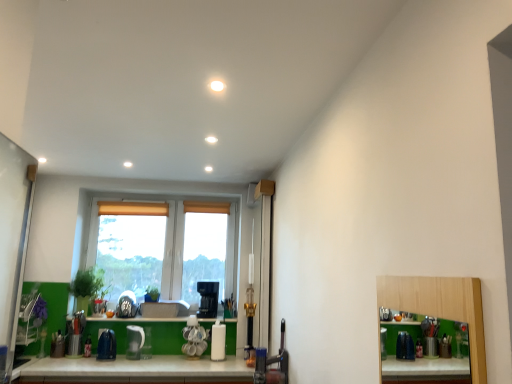
This screenshot has height=384, width=512. Describe the element at coordinates (152, 294) in the screenshot. I see `green matte plant at center, arranged as the first plant when viewed from the right` at that location.

This screenshot has height=384, width=512. What are the coordinates of `white glossy kettle at center, placed as the 2th appliance when sorted from left to right` in the screenshot? It's located at (134, 342).

Locate an element on the screen. white plastic window at center is located at coordinates (165, 251).

The height and width of the screenshot is (384, 512). I want to click on blue plastic kettle at lower center, the third appliance positioned from the right, so click(106, 345).

Is blue plastic kettle at lower center, placed as the 1th appliance when sorted from left to right, not close to white glossy kettle at center, placed as the second appliance when sorted from right to left?

Actually, blue plastic kettle at lower center, placed as the 1th appliance when sorted from left to right, and white glossy kettle at center, placed as the second appliance when sorted from right to left, are a little close together.

From the picture: From the image's perspective, which is above, blue plastic kettle at lower center, placed as the 1th appliance when sorted from left to right, or white glossy kettle at center, placed as the second appliance when sorted from right to left?

From the image's view, white glossy kettle at center, placed as the second appliance when sorted from right to left, is above.

From a real-world perspective, is blue plastic kettle at lower center, the third appliance positioned from the right, physically located above or below white glossy kettle at center, placed as the 2th appliance when sorted from left to right?

From a real-world perspective, blue plastic kettle at lower center, the third appliance positioned from the right, is physically below white glossy kettle at center, placed as the 2th appliance when sorted from left to right.

Is blue plastic kettle at lower center, placed as the 1th appliance when sorted from left to right, in front of or behind white glossy kettle at center, placed as the second appliance when sorted from right to left, in the image?

In the image, blue plastic kettle at lower center, placed as the 1th appliance when sorted from left to right, appears in front of white glossy kettle at center, placed as the second appliance when sorted from right to left.

How many degrees apart are the facing directions of blue plastic kettle at lower center, the third appliance positioned from the right, and green matte plant at center, arranged as the first plant when viewed from the right?

2.88 degrees separate the facing orientations of blue plastic kettle at lower center, the third appliance positioned from the right, and green matte plant at center, arranged as the first plant when viewed from the right.

Looking at their sizes, would you say blue plastic kettle at lower center, placed as the 1th appliance when sorted from left to right, is wider or thinner than green matte plant at center, which is the second plant in left-to-right order?

In the image, blue plastic kettle at lower center, placed as the 1th appliance when sorted from left to right, appears to be wider than green matte plant at center, which is the second plant in left-to-right order.

Which is closer to the camera, (109, 354) or (156, 292)?

Point (109, 354) appears to be closer to the viewer than point (156, 292).

Which of these two, blue plastic kettle at lower center, placed as the 1th appliance when sorted from left to right, or green matte plant at center, which is the second plant in left-to-right order, stands taller?

Standing taller between the two is blue plastic kettle at lower center, placed as the 1th appliance when sorted from left to right.

From a real-world perspective, between white glossy kettle at center, placed as the 2th appliance when sorted from left to right, and green matte plant at left, the 2th plant positioned from the right, who is vertically lower?

In real-world perspective, white glossy kettle at center, placed as the 2th appliance when sorted from left to right, is lower.

Is white glossy kettle at center, placed as the 2th appliance when sorted from left to right, looking in the opposite direction of green matte plant at left, acting as the 1th plant starting from the left?

white glossy kettle at center, placed as the 2th appliance when sorted from left to right, does not have its back to green matte plant at left, acting as the 1th plant starting from the left.

From the image's perspective, would you say white glossy kettle at center, placed as the 2th appliance when sorted from left to right, is shown under green matte plant at left, the 2th plant positioned from the right?

Yes, from the image's perspective, white glossy kettle at center, placed as the 2th appliance when sorted from left to right, is below green matte plant at left, the 2th plant positioned from the right.

Is point (182, 350) positioned in front of point (208, 281)?

Yes, point (182, 350) is closer to viewer.

Is white glossy coffee maker at center, placed as the 3th appliance when sorted from left to right, inside or outside of black plastic coffee machine at center?

white glossy coffee maker at center, placed as the 3th appliance when sorted from left to right, is located beyond the bounds of black plastic coffee machine at center.

Does white glossy coffee maker at center, which appears as the first appliance when viewed from the right, have a greater height compared to black plastic coffee machine at center?

Correct, white glossy coffee maker at center, which appears as the first appliance when viewed from the right, is much taller as black plastic coffee machine at center.

From the white plastic window at center, count the 2nd plant to the left and point to it. Please provide its 2D coordinates.

[(88, 287)]

Which of these two, green matte plant at left, the 2th plant positioned from the right, or white plastic window at center, stands taller?

Standing taller between the two is white plastic window at center.

Does green matte plant at left, the 2th plant positioned from the right, contain white plastic window at center?

Actually, white plastic window at center is outside green matte plant at left, the 2th plant positioned from the right.

Is green matte plant at left, the 2th plant positioned from the right, turned away from white plastic window at center?

Yes, green matte plant at left, the 2th plant positioned from the right, is facing away from white plastic window at center.

Find the location of `the 3rd appliance to the right of the green matte plant at left, the 2th plant positioned from the right, starting your count from the anchor`. the 3rd appliance to the right of the green matte plant at left, the 2th plant positioned from the right, starting your count from the anchor is located at coordinates (194, 338).

Is there a large distance between green matte plant at left, the 2th plant positioned from the right, and white glossy coffee maker at center, which appears as the first appliance when viewed from the right?

No, green matte plant at left, the 2th plant positioned from the right, is not far from white glossy coffee maker at center, which appears as the first appliance when viewed from the right.

Between point (76, 280) and point (188, 321), which one is positioned behind?

The point (76, 280) is farther from the camera.

How many degrees apart are the facing directions of green matte plant at center, which is the second plant in left-to-right order, and green matte window sill at lower center?

2.51 degrees separate the facing orientations of green matte plant at center, which is the second plant in left-to-right order, and green matte window sill at lower center.

Does point (156, 292) come closer to viewer compared to point (143, 319)?

That is False.

Is green matte plant at center, which is the second plant in left-to-right order, inside the boundaries of green matte window sill at lower center, or outside?

green matte plant at center, which is the second plant in left-to-right order, exists outside the volume of green matte window sill at lower center.

From the image's perspective, is green matte plant at center, arranged as the first plant when viewed from the right, located above or below green matte window sill at lower center?

Clearly, from the image's perspective, green matte plant at center, arranged as the first plant when viewed from the right, is above green matte window sill at lower center.

You are a GUI agent. You are given a task and a screenshot of the screen. Output one action in this format:
    pyautogui.click(x=<x>, y=<y>)
    Task: Click on the appliance below the white glossy kettle at center, placed as the 2th appliance when sorted from left to right (from a real-world perspective)
    
    Given the screenshot: What is the action you would take?
    pyautogui.click(x=106, y=345)

You are a GUI agent. You are given a task and a screenshot of the screen. Output one action in this format:
    pyautogui.click(x=<x>, y=<y>)
    Task: Click on the 2nd plant behind the blue plastic kettle at lower center, placed as the 1th appliance when sorted from left to right
    
    Given the screenshot: What is the action you would take?
    pyautogui.click(x=152, y=294)

In the scene shown: Estimate the real-world distances between objects in this image. Which object is closer to green matte plant at center, which is the second plant in left-to-right order, blue plastic kettle at lower center, the third appliance positioned from the right, or white plastic window at center?

Based on the image, white plastic window at center appears to be nearer to green matte plant at center, which is the second plant in left-to-right order.

From the image, which object appears to be farther from green matte plant at left, acting as the 1th plant starting from the left, blue plastic kettle at lower center, placed as the 1th appliance when sorted from left to right, or white plastic window at center?

Among the two, white plastic window at center is located further to green matte plant at left, acting as the 1th plant starting from the left.

Looking at the image, which one is located further to white glossy coffee maker at center, which appears as the first appliance when viewed from the right, green matte window sill at lower center or green matte plant at left, the 2th plant positioned from the right?

green matte plant at left, the 2th plant positioned from the right, lies further to white glossy coffee maker at center, which appears as the first appliance when viewed from the right, than the other object.

From the image, which object appears to be nearer to green matte plant at center, which is the second plant in left-to-right order, blue plastic kettle at lower center, placed as the 1th appliance when sorted from left to right, or white glossy kettle at center, placed as the second appliance when sorted from right to left?

white glossy kettle at center, placed as the second appliance when sorted from right to left, lies closer to green matte plant at center, which is the second plant in left-to-right order, than the other object.

In the scene shown: Considering their positions, is green matte window sill at lower center positioned closer to green matte plant at center, arranged as the first plant when viewed from the right, than green matte plant at left, the 2th plant positioned from the right?

Based on the image, green matte window sill at lower center appears to be nearer to green matte plant at center, arranged as the first plant when viewed from the right.

When comparing their distances from blue plastic kettle at lower center, placed as the 1th appliance when sorted from left to right, does green matte window sill at lower center or white plastic window at center seem further?

Among the two, white plastic window at center is located further to blue plastic kettle at lower center, placed as the 1th appliance when sorted from left to right.

When comparing their distances from black plastic coffee machine at center, does green matte window sill at lower center or white glossy coffee maker at center, which appears as the first appliance when viewed from the right, seem further?

green matte window sill at lower center is positioned further to the anchor black plastic coffee machine at center.

When comparing their distances from white plastic window at center, does white glossy coffee maker at center, placed as the 3th appliance when sorted from left to right, or green matte window sill at lower center seem further?

The object further to white plastic window at center is white glossy coffee maker at center, placed as the 3th appliance when sorted from left to right.

I want to click on window between green matte plant at left, the 2th plant positioned from the right, and black plastic coffee machine at center, so click(165, 251).

Identify the location of window sill situated between green matte plant at left, the 2th plant positioned from the right, and white glossy coffee maker at center, placed as the 3th appliance when sorted from left to right, from left to right. Image resolution: width=512 pixels, height=384 pixels. (135, 319).

Find the location of `window sill between white plastic window at center and white glossy coffee maker at center, which appears as the first appliance when viewed from the right, vertically`. window sill between white plastic window at center and white glossy coffee maker at center, which appears as the first appliance when viewed from the right, vertically is located at coordinates (135, 319).

You are a GUI agent. You are given a task and a screenshot of the screen. Output one action in this format:
    pyautogui.click(x=<x>, y=<y>)
    Task: Click on the window sill between blue plastic kettle at lower center, the third appliance positioned from the right, and black plastic coffee machine at center
    
    Given the screenshot: What is the action you would take?
    pyautogui.click(x=135, y=319)